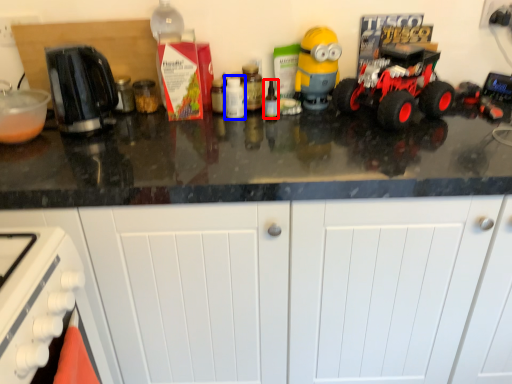
Question: Which point is closer to the camera, bottle (highlighted by a red box) or bottle (highlighted by a blue box)?

Choices:
 (A) bottle
 (B) bottle

Answer: (A)